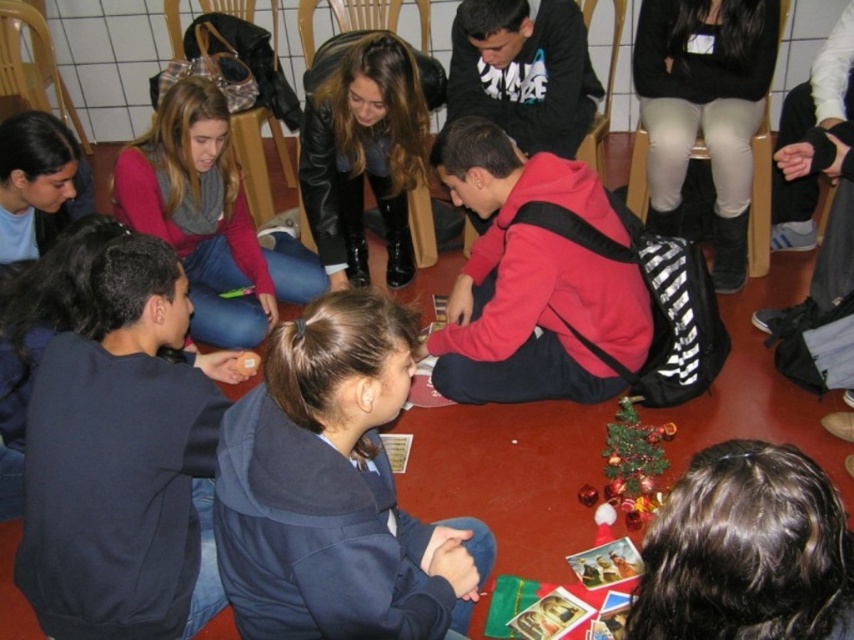
Question: Is dark brown hair at lower right to the left of matte red sweater at center from the viewer's perspective?

Choices:
 (A) no
 (B) yes

Answer: (A)

Question: Can you confirm if dark blue hoodie at center is positioned below dark brown hair at lower right?

Choices:
 (A) yes
 (B) no

Answer: (A)

Question: Does dark blue hoodie at center appear on the left side of leather jacket at center?

Choices:
 (A) no
 (B) yes

Answer: (A)

Question: Which point is closer to the camera?

Choices:
 (A) (237, 588)
 (B) (330, 72)
 (C) (130, 180)
 (D) (802, 573)

Answer: (D)

Question: Estimate the real-world distances between objects in this image. Which object is farther from the dark brown hair at lower right?

Choices:
 (A) leather jacket at center
 (B) matte red sweater at center

Answer: (B)

Question: Which object is farther from the camera taking this photo?

Choices:
 (A) dark brown hair at lower right
 (B) leather jacket at center

Answer: (B)